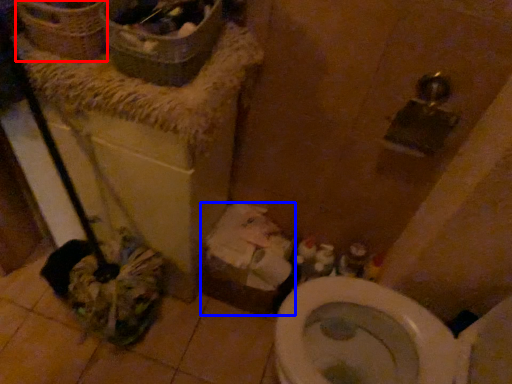
Question: Among these objects, which one is farthest to the camera, basket (highlighted by a red box) or cardboard box (highlighted by a blue box)?

Choices:
 (A) basket
 (B) cardboard box

Answer: (B)